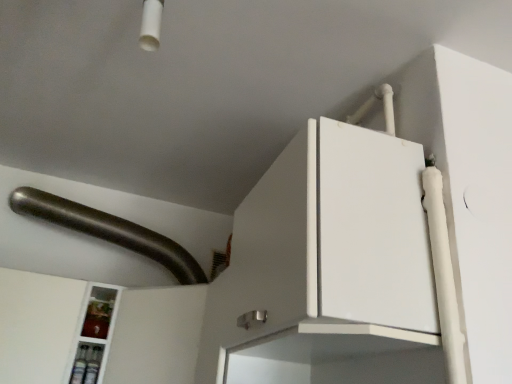
Identify the location of satin silver handle at upper left. (108, 231).

What do you see at coordinates (108, 231) in the screenshot?
I see `satin silver handle at upper left` at bounding box center [108, 231].

Where is `white glossy cabinet at lower left`? This screenshot has width=512, height=384. white glossy cabinet at lower left is located at coordinates (38, 326).

What is the approximate height of white glossy cabinet at lower left?

The height of white glossy cabinet at lower left is 43.91 centimeters.

The height and width of the screenshot is (384, 512). Describe the element at coordinates (38, 326) in the screenshot. I see `white glossy cabinet at lower left` at that location.

Locate an element on the screen. The image size is (512, 384). satin silver handle at upper left is located at coordinates (108, 231).

Is white glossy cabinet at lower left at the left side of satin silver handle at upper left?

Yes, white glossy cabinet at lower left is to the left of satin silver handle at upper left.

Considering the relative positions of white glossy cabinet at lower left and satin silver handle at upper left in the image provided, is white glossy cabinet at lower left in front of satin silver handle at upper left?

Yes, white glossy cabinet at lower left is closer to the viewer.

Does point (161, 302) lie behind point (115, 238)?

No, it is in front of (115, 238).

From the image's perspective, between white glossy cabinet at lower left and satin silver handle at upper left, who is located below?

white glossy cabinet at lower left, from the image's perspective.

From a real-world perspective, between white glossy cabinet at lower left and satin silver handle at upper left, who is vertically lower?

From a 3D spatial view, white glossy cabinet at lower left is below.

Considering the relative sizes of white glossy cabinet at lower left and satin silver handle at upper left in the image provided, is white glossy cabinet at lower left wider than satin silver handle at upper left?

No, white glossy cabinet at lower left is not wider than satin silver handle at upper left.

Considering the sizes of objects white glossy cabinet at lower left and satin silver handle at upper left in the image provided, who is taller, white glossy cabinet at lower left or satin silver handle at upper left?

white glossy cabinet at lower left.

Considering the sizes of objects white glossy cabinet at lower left and satin silver handle at upper left in the image provided, who is smaller, white glossy cabinet at lower left or satin silver handle at upper left?

Smaller between the two is white glossy cabinet at lower left.

Would you say satin silver handle at upper left is part of white glossy cabinet at lower left's contents?

Definitely not — satin silver handle at upper left is not inside white glossy cabinet at lower left.

Is there a large distance between white glossy cabinet at lower left and satin silver handle at upper left?

No, white glossy cabinet at lower left is not far away from satin silver handle at upper left.

Is white glossy cabinet at lower left oriented away from satin silver handle at upper left?

No, white glossy cabinet at lower left is not facing the opposite direction of satin silver handle at upper left.

How different are the orientations of white glossy cabinet at lower left and satin silver handle at upper left in degrees?

The angular difference between white glossy cabinet at lower left and satin silver handle at upper left is 0.000433 degrees.

Find the location of a particular element. The width and height of the screenshot is (512, 384). cabinetry below the satin silver handle at upper left (from the image's perspective) is located at coordinates pos(38,326).

Does satin silver handle at upper left appear on the right side of white glossy cabinet at lower left?

Yes.

Is the depth of satin silver handle at upper left greater than that of white glossy cabinet at lower left?

Yes, it is behind white glossy cabinet at lower left.

Between point (63, 209) and point (129, 368), which one is positioned in front?

Positioned in front is point (129, 368).

From the image's perspective, would you say satin silver handle at upper left is positioned over white glossy cabinet at lower left?

Yes, from the image's perspective, satin silver handle at upper left is on top of white glossy cabinet at lower left.

From a real-world perspective, is satin silver handle at upper left physically above white glossy cabinet at lower left?

Yes, from a real-world perspective, satin silver handle at upper left is above white glossy cabinet at lower left.

Is satin silver handle at upper left wider or thinner than white glossy cabinet at lower left?

Clearly, satin silver handle at upper left has more width compared to white glossy cabinet at lower left.

Can you confirm if satin silver handle at upper left is shorter than white glossy cabinet at lower left?

Correct, satin silver handle at upper left is not as tall as white glossy cabinet at lower left.

Looking at the image, does satin silver handle at upper left seem bigger or smaller compared to white glossy cabinet at lower left?

satin silver handle at upper left is bigger than white glossy cabinet at lower left.

Is satin silver handle at upper left inside or outside of white glossy cabinet at lower left?

satin silver handle at upper left exists outside the volume of white glossy cabinet at lower left.

Based on the photo, is satin silver handle at upper left positioned far away from white glossy cabinet at lower left?

No, there isn't a large distance between satin silver handle at upper left and white glossy cabinet at lower left.

Is satin silver handle at upper left facing away from white glossy cabinet at lower left?

satin silver handle at upper left does not have its back to white glossy cabinet at lower left.

I want to click on door handle that appears above the white glossy cabinet at lower left (from the image's perspective), so click(108, 231).

Locate an element on the screen. The image size is (512, 384). door handle on the right side of white glossy cabinet at lower left is located at coordinates (108, 231).

Locate an element on the screen. Image resolution: width=512 pixels, height=384 pixels. cabinetry on the left of satin silver handle at upper left is located at coordinates (38, 326).